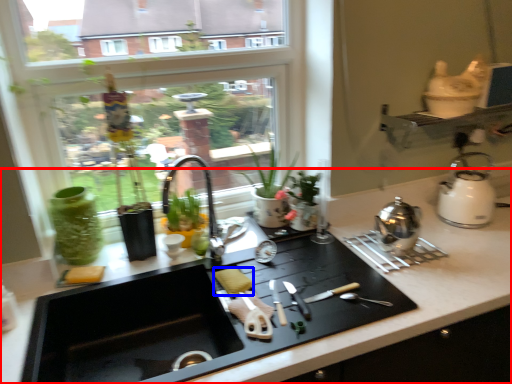
Question: Which object is further to the camera taking this photo, countertop (highlighted by a red box) or food (highlighted by a blue box)?

Choices:
 (A) countertop
 (B) food

Answer: (B)